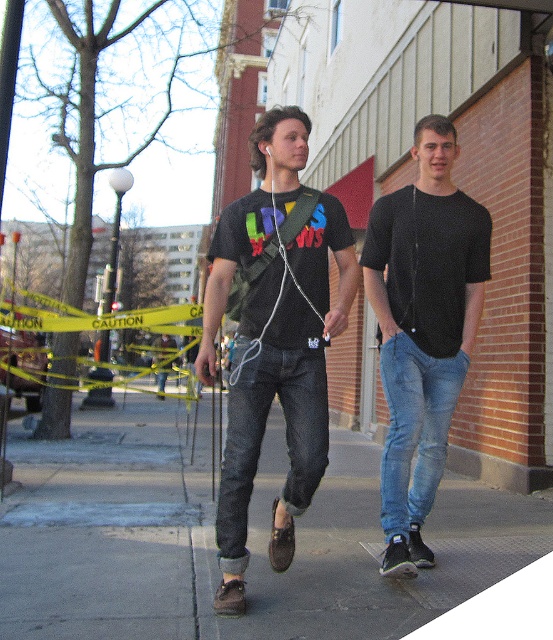
Question: Which point is closer to the camera taking this photo?

Choices:
 (A) (237, 248)
 (B) (390, 442)
 (C) (195, 506)

Answer: (A)

Question: Is denim at center bigger than blue denim jeans at right?

Choices:
 (A) yes
 (B) no

Answer: (B)

Question: Is matte black t-shirt at center to the left of black matte t-shirt at center from the viewer's perspective?

Choices:
 (A) no
 (B) yes

Answer: (B)

Question: Among these objects, which one is nearest to the camera?

Choices:
 (A) blue denim jeans at right
 (B) matte black t-shirt at center
 (C) smooth concrete sidewalk at center
 (D) black matte t-shirt at center

Answer: (C)

Question: Is smooth concrete sidewalk at center smaller than matte black t-shirt at center?

Choices:
 (A) no
 (B) yes

Answer: (A)

Question: Which object is the closest to the smooth concrete sidewalk at center?

Choices:
 (A) blue denim jeans at right
 (B) black matte t-shirt at center
 (C) denim at center
 (D) matte black t-shirt at center

Answer: (C)